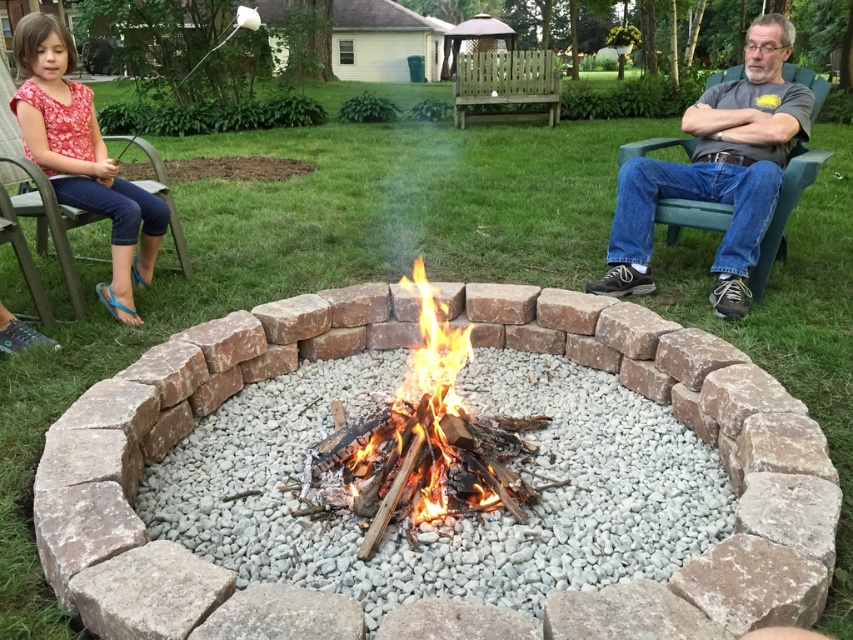
Based on the photo, what is the 2D coordinate of the red brick fire pit at center?

The red brick fire pit at center is located at the 2D coordinate point of (170, 445).

Consider the image. You are planning to place a small table between the red brick fire pit at center and the floral fabric dress at left. Given that the table is 1 meter wide, will it fit without overlapping either object?

The red brick fire pit at center is wider than the floral fabric dress at left. Since the table is 1 meter wide, it depends on the actual widths of the fire pit and the dress. However, the description only states the fire pit is wider, not by how much. Without specific measurements, we cannot confirm if the table will fit.